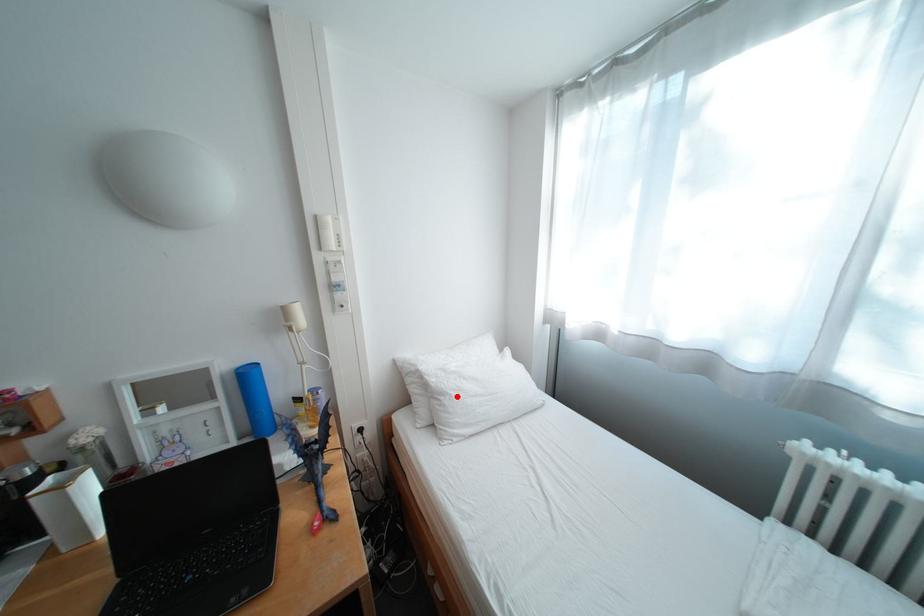
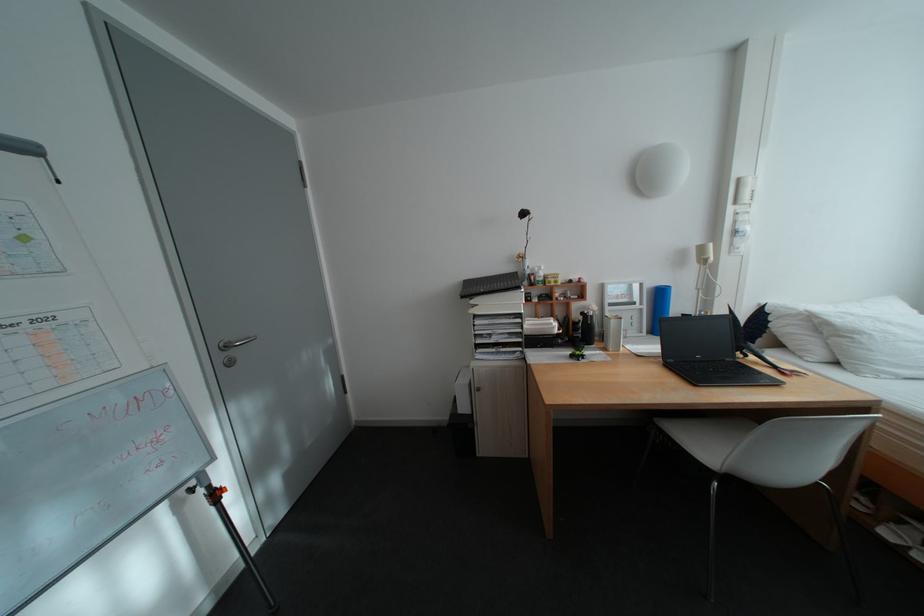
In the second image, find the point that corresponds to the highlighted location in the first image.

(871, 334)